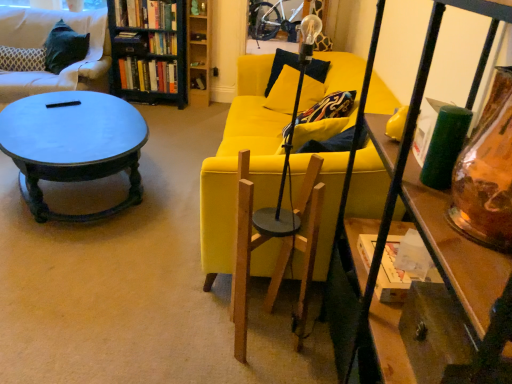
Identify the location of yellow fabric couch at center, the 2th studio couch positioned from the back. The image size is (512, 384). (237, 164).

What are the coordinates of `dark gray fabric couch at upper left, which is the 2th studio couch in bottom-to-top order` in the screenshot? It's located at (42, 45).

At what (x,y) coordinates should I click in order to perform the action: click on velvet black pillow at upper left. Please return your answer as a coordinate pair (x, y). The image size is (512, 384). Looking at the image, I should click on (22, 59).

This screenshot has height=384, width=512. I want to click on hardcover books at upper left, arranged as the 1th book when viewed from the top, so click(x=146, y=14).

Is velvet black pillow at upper left located outside black painted wood bookcase at upper left?

velvet black pillow at upper left lies outside black painted wood bookcase at upper left's area.

From the image's perspective, would you say velvet black pillow at upper left is positioned over black painted wood bookcase at upper left?

No, from the image's perspective, velvet black pillow at upper left is not above black painted wood bookcase at upper left.

From a real-world perspective, who is located lower, velvet black pillow at upper left or black painted wood bookcase at upper left?

velvet black pillow at upper left, from a real-world perspective.

In the image, is velvet black pillow at upper left positioned in front of or behind black painted wood bookcase at upper left?

velvet black pillow at upper left is positioned closer to the viewer than black painted wood bookcase at upper left.

From a real-world perspective, relative to wooden bookshelf at center, is dark gray fabric couch at upper left, the 2th studio couch when ordered from front to back, vertically above or below?

From a real-world perspective, dark gray fabric couch at upper left, the 2th studio couch when ordered from front to back, is physically above wooden bookshelf at center.

Does dark gray fabric couch at upper left, the 2th studio couch when ordered from front to back, contain wooden bookshelf at center?

No, wooden bookshelf at center is located outside of dark gray fabric couch at upper left, the 2th studio couch when ordered from front to back.

Looking at this image, considering their positions, is dark gray fabric couch at upper left, the 2th studio couch when ordered from front to back, located in front of or behind wooden bookshelf at center?

Visually, dark gray fabric couch at upper left, the 2th studio couch when ordered from front to back, is located in front of wooden bookshelf at center.

This screenshot has width=512, height=384. What are the coordinates of `studio couch that is on the left side of wooden bookshelf at center` in the screenshot? It's located at (42, 45).

Is point (300, 90) closer or farther from the camera than point (41, 59)?

Point (300, 90) is positioned closer to the camera compared to point (41, 59).

Does clear glass lamp at center lie behind velvet black pillow at upper left?

No, clear glass lamp at center is closer to the viewer.

Is velvet black pillow at upper left surrounded by clear glass lamp at center?

That's incorrect, velvet black pillow at upper left is not inside clear glass lamp at center.

Who is shorter, black painted wood bookcase at upper left or hardcover books at upper left, which is counted as the second book, starting from the top?

hardcover books at upper left, which is counted as the second book, starting from the top, is shorter.

Considering the positions of objects black painted wood bookcase at upper left and hardcover books at upper left, which is counted as the second book, starting from the bottom, in the image provided, who is more to the right, black painted wood bookcase at upper left or hardcover books at upper left, which is counted as the second book, starting from the bottom,?

Positioned to the right is hardcover books at upper left, which is counted as the second book, starting from the bottom.

From a real-world perspective, is black painted wood bookcase at upper left positioned above or below hardcover books at upper left, which is counted as the second book, starting from the bottom?

black painted wood bookcase at upper left is below hardcover books at upper left, which is counted as the second book, starting from the bottom.

Which is in front, point (195, 76) or point (277, 235)?

Point (277, 235)

Find the location of a particular element. The height and width of the screenshot is (384, 512). shelf lying behind the clear glass lamp at center is located at coordinates (199, 51).

How much distance is there between wooden bookshelf at center and clear glass lamp at center?

A distance of 2.50 meters exists between wooden bookshelf at center and clear glass lamp at center.

Considering the sizes of objects wooden bookshelf at center and clear glass lamp at center in the image provided, who is wider, wooden bookshelf at center or clear glass lamp at center?

wooden bookshelf at center.

From the image's perspective, which is below, yellow fabric couch at center, the 2th studio couch positioned from the back, or wooden bookshelf at center?

yellow fabric couch at center, the 2th studio couch positioned from the back.

Is yellow fabric couch at center, which ranks as the first studio couch in bottom-to-top order, spatially inside wooden bookshelf at center, or outside of it?

The correct answer is: outside.

How far apart are yellow fabric couch at center, arranged as the 2th studio couch when viewed from the left, and wooden bookshelf at center?

yellow fabric couch at center, arranged as the 2th studio couch when viewed from the left, and wooden bookshelf at center are 6.27 feet apart from each other.

From the image's perspective, which one is positioned higher, hardcover books at upper left, which is counted as the second book, starting from the bottom, or clear glass lamp at center?

From the image's view, hardcover books at upper left, which is counted as the second book, starting from the bottom, is above.

Which is less distant, [170,48] or [302,21]?

Point [170,48] appears to be farther away from the viewer than point [302,21].

Where is `lamp located above the hardcover books at upper left, which is counted as the second book, starting from the top (from a real-world perspective)`? The width and height of the screenshot is (512, 384). lamp located above the hardcover books at upper left, which is counted as the second book, starting from the top (from a real-world perspective) is located at coordinates (289, 144).

Is hardcover books at upper left, which is counted as the second book, starting from the top, located outside clear glass lamp at center?

That's correct, hardcover books at upper left, which is counted as the second book, starting from the top, is outside of clear glass lamp at center.

Find the location of `bookcase lying on the right of velvet black pillow at upper left`. bookcase lying on the right of velvet black pillow at upper left is located at coordinates (148, 50).

From the image's perspective, count 1st studio couchs downward from the wooden bookshelf at center and point to it. Please provide its 2D coordinates.

[(42, 45)]

Based on their spatial positions, is hardcover books at upper left, which is counted as the second book, starting from the bottom, or hardcover books at upper left, placed as the third book when sorted from bottom to top, closer to wooden bookshelf at center?

Based on the image, hardcover books at upper left, which is counted as the second book, starting from the bottom, appears to be nearer to wooden bookshelf at center.

Which object lies nearer to the anchor point wooden bookshelf at center, black painted wood bookcase at upper left or hardcover books at upper left, arranged as the 1th book when viewed from the top?

Among the two, black painted wood bookcase at upper left is located nearer to wooden bookshelf at center.

Looking at the image, which one is located closer to dark gray fabric couch at upper left, positioned as the 1th studio couch in left-to-right order, hardcover books at upper left, which is counted as the second book, starting from the bottom, or wooden bookshelf at center?

hardcover books at upper left, which is counted as the second book, starting from the bottom, is positioned closer to the anchor dark gray fabric couch at upper left, positioned as the 1th studio couch in left-to-right order.

Estimate the real-world distances between objects in this image. Which object is closer to clear glass lamp at center, yellow fabric couch at center, the 2th studio couch positioned from the back, or hardcover books at upper left, which is counted as the second book, starting from the bottom?

Among the two, yellow fabric couch at center, the 2th studio couch positioned from the back, is located nearer to clear glass lamp at center.

From the picture: From the image, which object appears to be farther from hardcover books at upper left, which is counted as the second book, starting from the top, velvet black pillow at upper left or matte dark blue coffee table at left?

Based on the image, matte dark blue coffee table at left appears to be further to hardcover books at upper left, which is counted as the second book, starting from the top.

When comparing their distances from hardcover books at upper left, the 3th book from the top, does wooden bookshelf at center or matte dark blue coffee table at left seem further?

matte dark blue coffee table at left lies further to hardcover books at upper left, the 3th book from the top, than the other object.

Which object lies further to the anchor point hardcover books at upper left, which ranks as the first book in bottom-to-top order, hardcover books at upper left, which is counted as the second book, starting from the top, or yellow fabric couch at center, the second studio couch viewed from the top?

yellow fabric couch at center, the second studio couch viewed from the top.

Estimate the real-world distances between objects in this image. Which object is further from hardcover books at upper left, the 3th book from the top, yellow fabric couch at center, placed as the 1th studio couch when sorted from front to back, or velvet black pillow at upper left?

The object further to hardcover books at upper left, the 3th book from the top, is yellow fabric couch at center, placed as the 1th studio couch when sorted from front to back.

Find the location of a particular element. The image size is (512, 384). coffee table between yellow fabric couch at center, the 1th studio couch in the right-to-left sequence, and hardcover books at upper left, which ranks as the first book in bottom-to-top order, from front to back is located at coordinates (73, 145).

I want to click on studio couch between yellow fabric couch at center, arranged as the 2th studio couch when viewed from the left, and black painted wood bookcase at upper left in the front-back direction, so click(x=42, y=45).

Where is `book positioned between matte dark blue coffee table at left and hardcover books at upper left, which is counted as the second book, starting from the bottom, from near to far`? book positioned between matte dark blue coffee table at left and hardcover books at upper left, which is counted as the second book, starting from the bottom, from near to far is located at coordinates 146,14.

At what (x,y) coordinates should I click in order to perform the action: click on bookcase between yellow fabric couch at center, the 2th studio couch positioned from the back, and hardcover books at upper left, arranged as the 1th book when viewed from the top, from front to back. Please return your answer as a coordinate pair (x, y). The image size is (512, 384). Looking at the image, I should click on (148, 50).